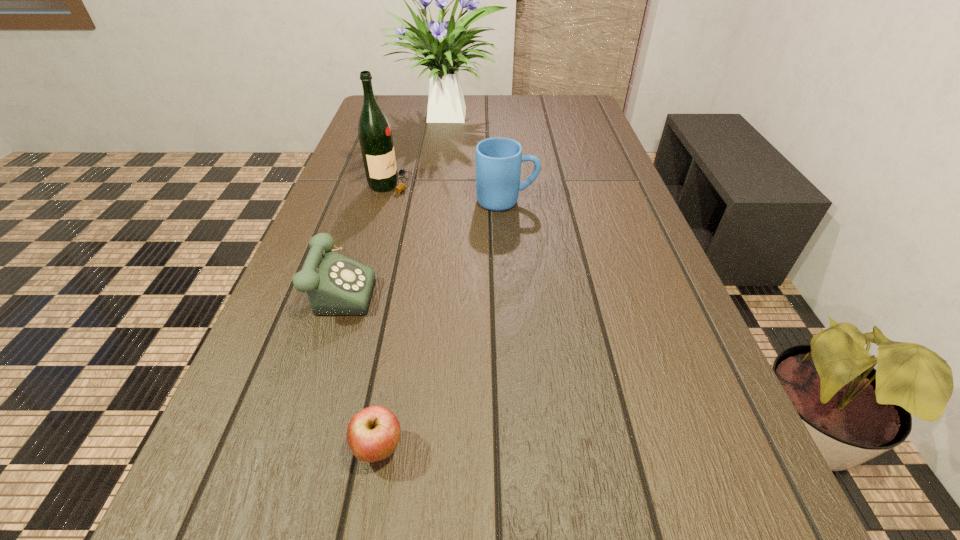
The image size is (960, 540). I want to click on vacant space at the right edge of the desktop, so (x=610, y=183).

In the image, there is a desktop. In order to click on vacant space at the far left corner in this screenshot , I will do `click(384, 110)`.

The width and height of the screenshot is (960, 540). I want to click on vacant area at the far right corner, so click(562, 117).

The image size is (960, 540). Identify the location of vacant area that lies between the second tallest object and the third shortest object. (448, 193).

Find the location of `vacant area that lies between the tallest object and the second nearest object`. vacant area that lies between the tallest object and the second nearest object is located at coordinates (393, 200).

Image resolution: width=960 pixels, height=540 pixels. Identify the location of unoccupied position between the shortest object and the tallest object. (412, 283).

Find the location of a particular element. empty location between the mug and the apple is located at coordinates (443, 325).

The height and width of the screenshot is (540, 960). I want to click on empty space between the second tallest object and the third shortest object, so click(x=448, y=193).

At what (x,y) coordinates should I click in order to perform the action: click on vacant area that lies between the second nearest object and the second tallest object. Please return your answer as a coordinate pair (x, y). Looking at the image, I should click on (365, 234).

Find the location of a particular element. Image resolution: width=960 pixels, height=540 pixels. free space between the fourth shortest object and the apple is located at coordinates (385, 316).